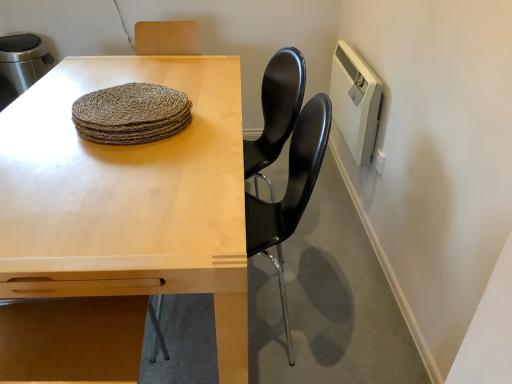
Question: Considering the relative positions of black glossy chair at center and light wood table at center in the image provided, is black glossy chair at center to the left or to the right of light wood table at center?

Choices:
 (A) left
 (B) right

Answer: (B)

Question: Is point [293, 129] positioned closer to the camera than point [133, 74]?

Choices:
 (A) closer
 (B) farther

Answer: (A)

Question: Which of these objects is positioned farthest from the white plastic radiator at upper right?

Choices:
 (A) light wood table at center
 (B) natural woven placemat at center
 (C) black glossy chair at center

Answer: (B)

Question: Estimate the real-world distances between objects in this image. Which object is farther from the natural woven placemat at center?

Choices:
 (A) white plastic radiator at upper right
 (B) black glossy chair at center
 (C) light wood table at center

Answer: (A)